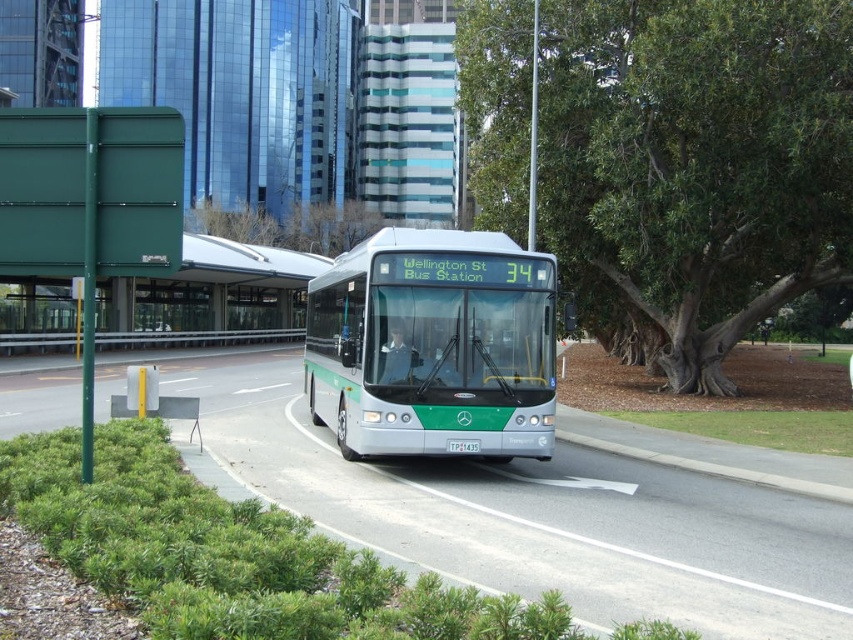
You are standing at the bus stop on the left side of the image and want to take a photo of the bus. Which point, point (747, 172) or point (515, 500), is closer to your camera when taking the photo?

Point (747, 172) is further to the camera than point (515, 500), so the closer point to your camera would be point (515, 500).

You are a pedestrian standing at the bus stop on the left side of the image. You see both the green metallic bus at center and the silver metallic bus at center approaching. Which bus will arrive first?

The green metallic bus at center is bigger than the silver metallic bus at center, so the green metallic bus at center will arrive first because it is closer to the bus stop.

You are a pedestrian standing at the bus stop on the left side of the image. You want to cross the street to reach the green leafy tree at center. The road is 10 meters wide. Can you safely cross the road before the bus arrives if the bus is 50 meters away from you and approaching at 20 km per hour?

The green leafy tree at center is 16.92 meters away from camera. Since the road is 10 meters wide and the tree is 16.92 meters away, you can cross the road safely. The bus is 50 meters away and moving at 20 km per hour. To calculate if you can cross in time, first convert the bus speed to meters per second. 20 km per hour is approximately 5.56 m per second. The time it takes the bus to reach you is 50 meters divided by 5.56 m per second, which is about 9 seconds. The time needed to cross the 10 meter road,